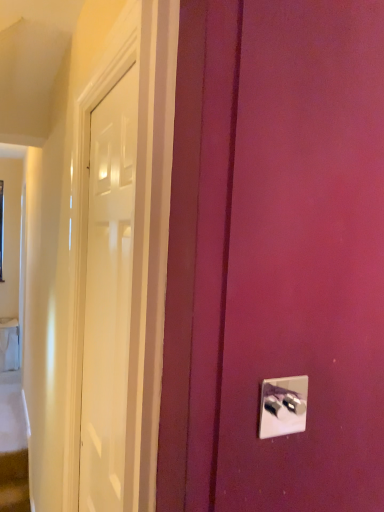
Question: From the image's perspective, is metallic silver light switch at lower right below white glossy door at left?

Choices:
 (A) yes
 (B) no

Answer: (B)

Question: Is white glossy door at left at the back of metallic silver light switch at lower right?

Choices:
 (A) yes
 (B) no

Answer: (A)

Question: Can you confirm if metallic silver light switch at lower right is thinner than white glossy door at left?

Choices:
 (A) no
 (B) yes

Answer: (B)

Question: Does metallic silver light switch at lower right appear on the left side of white glossy door at left?

Choices:
 (A) no
 (B) yes

Answer: (A)

Question: From a real-world perspective, does metallic silver light switch at lower right stand above white glossy door at left?

Choices:
 (A) yes
 (B) no

Answer: (A)

Question: Considering the relative sizes of metallic silver light switch at lower right and white glossy door at left in the image provided, is metallic silver light switch at lower right wider than white glossy door at left?

Choices:
 (A) yes
 (B) no

Answer: (B)

Question: Does white glossy door at left turn towards metallic silver light switch at lower right?

Choices:
 (A) no
 (B) yes

Answer: (A)

Question: Considering the relative positions of white glossy door at left and metallic silver light switch at lower right in the image provided, is white glossy door at left to the right of metallic silver light switch at lower right from the viewer's perspective?

Choices:
 (A) no
 (B) yes

Answer: (A)

Question: Can metallic silver light switch at lower right be found inside white glossy door at left?

Choices:
 (A) no
 (B) yes

Answer: (A)

Question: Is white glossy door at left closer to camera compared to metallic silver light switch at lower right?

Choices:
 (A) no
 (B) yes

Answer: (A)

Question: Is white glossy door at left bigger than metallic silver light switch at lower right?

Choices:
 (A) yes
 (B) no

Answer: (A)

Question: From a real-world perspective, is white glossy door at left located higher than metallic silver light switch at lower right?

Choices:
 (A) no
 (B) yes

Answer: (A)

Question: Looking at their shapes, would you say white glossy door at left is wider or thinner than metallic silver light switch at lower right?

Choices:
 (A) wide
 (B) thin

Answer: (A)